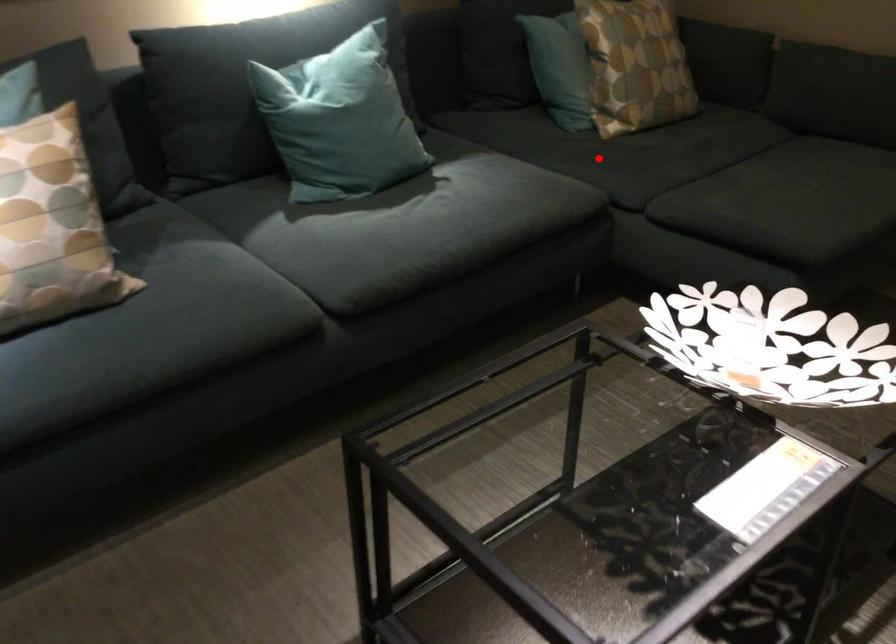
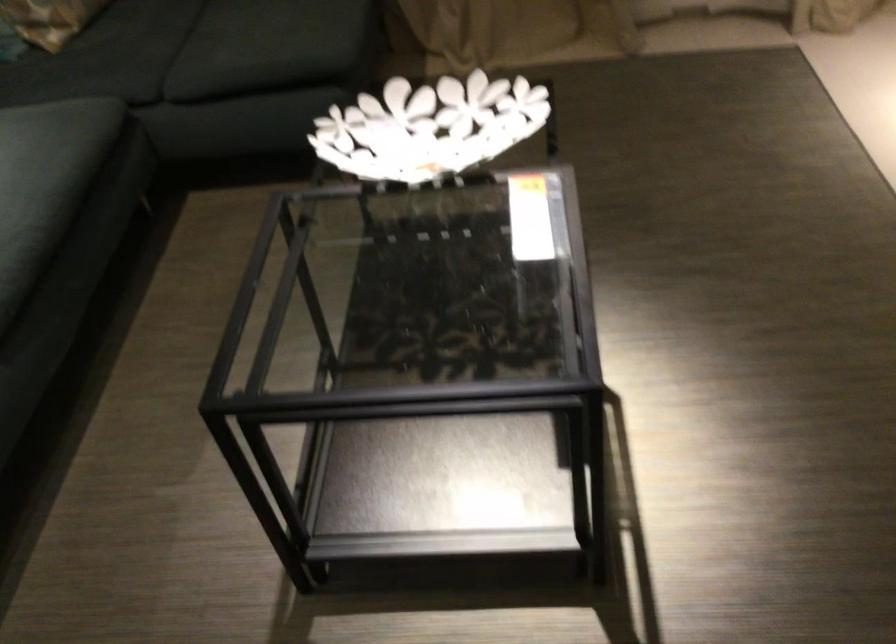
Question: I am providing you with two images of the same scene from different viewpoints. A red point is shown in image1. For the corresponding object point in image2, is it positioned nearer or farther from the camera?

Choices:
 (A) Nearer
 (B) Farther

Answer: (A)